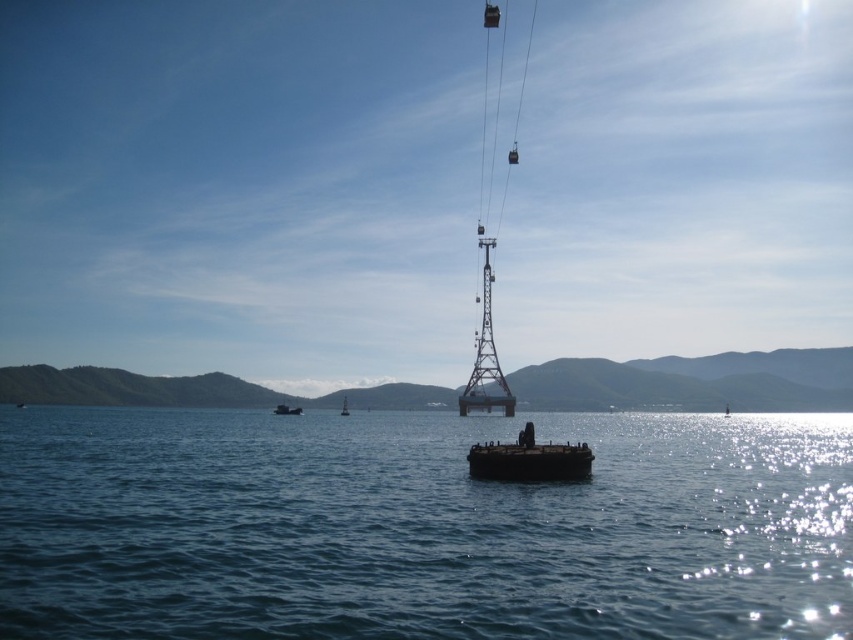
Is dark matte barge at center positioned in front of dark brown wooden boat at center?

Yes, dark matte barge at center is in front of dark brown wooden boat at center.

Does dark matte barge at center have a larger size compared to dark brown wooden boat at center?

Incorrect, dark matte barge at center is not larger than dark brown wooden boat at center.

The width and height of the screenshot is (853, 640). What do you see at coordinates (529, 460) in the screenshot? I see `dark matte barge at center` at bounding box center [529, 460].

Find the location of `dark matte barge at center`. dark matte barge at center is located at coordinates (529, 460).

Can you confirm if blue water at center is shorter than dark brown wooden boat at center?

No, blue water at center is not shorter than dark brown wooden boat at center.

Does point (283, 528) come behind point (277, 413)?

That is False.

Is point (204, 547) positioned before point (280, 412)?

Yes, point (204, 547) is closer to viewer.

What are the coordinates of `blue water at center` in the screenshot? It's located at (421, 528).

Looking at this image, measure the distance between point (550, 451) and camera.

A distance of 98.16 meters exists between point (550, 451) and camera.

Is dark matte barge at center above metallic gray buoy at center?

Indeed, dark matte barge at center is positioned over metallic gray buoy at center.

Does point (486, 461) come farther from viewer compared to point (347, 410)?

No, (486, 461) is in front of (347, 410).

Locate an element on the screen. This screenshot has width=853, height=640. dark matte barge at center is located at coordinates (529, 460).